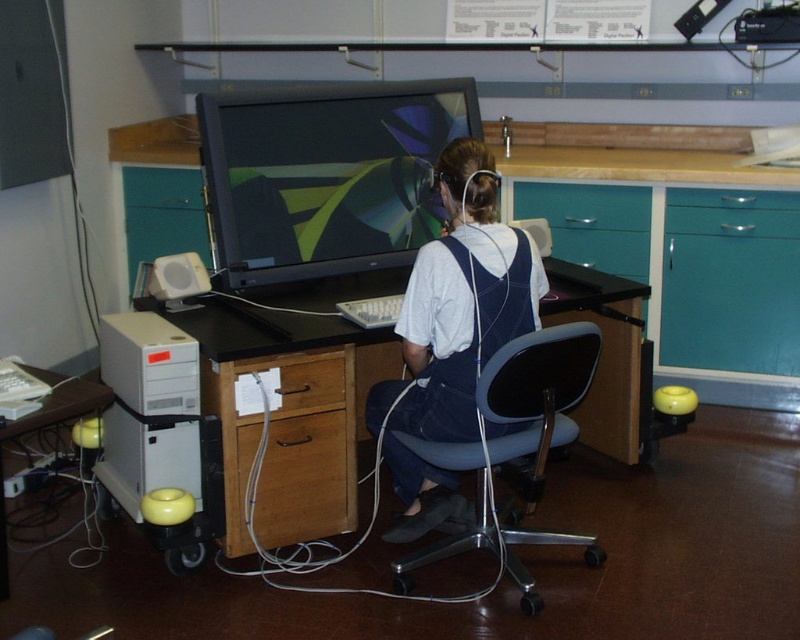
Question: Which object is positioned farthest from the brown wood drawer at lower center?

Choices:
 (A) blue fabric office chair at center
 (B) matte black monitor at center
 (C) white plastic table at lower left
 (D) wooden drawer at lower center

Answer: (B)

Question: Is wooden drawer at lower center below brown wood drawer at lower center?

Choices:
 (A) no
 (B) yes

Answer: (B)

Question: Is wooden drawer at lower center positioned behind white plastic table at lower left?

Choices:
 (A) no
 (B) yes

Answer: (B)

Question: Among these points, which one is nearest to the camera?

Choices:
 (A) (584, 188)
 (B) (240, 200)
 (C) (320, 531)

Answer: (B)

Question: Which point is farther from the camera taking this photo?

Choices:
 (A) (229, 488)
 (B) (340, 106)
 (C) (588, 209)

Answer: (C)

Question: From the image, what is the correct spatial relationship of matte black monitor at center in relation to blue fabric office chair at center?

Choices:
 (A) below
 (B) above

Answer: (B)